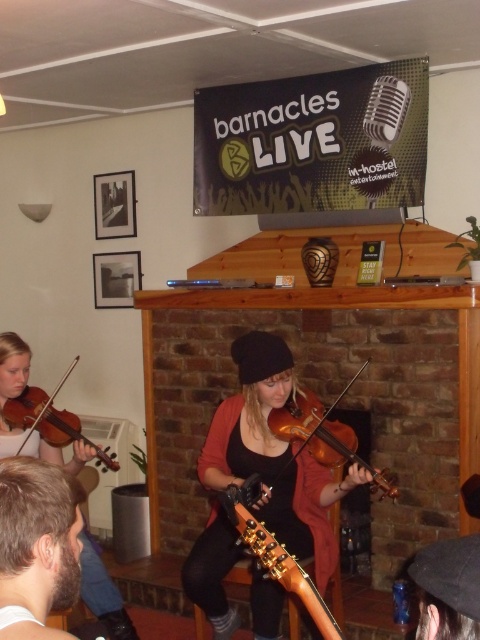
Is matte black violin at center to the left of matte brown violin at left from the viewer's perspective?

Correct, you'll find matte black violin at center to the left of matte brown violin at left.

Between point (98, 604) and point (33, 429), which one is positioned behind?

The point (98, 604) is more distant.

Image resolution: width=480 pixels, height=640 pixels. What are the coordinates of `matte black violin at center` in the screenshot? It's located at (17, 396).

Which is below, matte brown violin at center or wooden violin at center?

matte brown violin at center is below.

What do you see at coordinates (274, 456) in the screenshot? I see `matte brown violin at center` at bounding box center [274, 456].

Which is in front, point (254, 593) or point (384, 483)?

Point (384, 483) is more forward.

Identify the location of matte brown violin at center. The width and height of the screenshot is (480, 640). (274, 456).

Measure the distance between point (x=57, y=570) and camera.

The distance of point (x=57, y=570) from camera is 3.52 feet.

Between point (21, 548) and point (55, 440), which one is positioned behind?

The point (55, 440) is more distant.

Locate an element on the screen. bearded man at lower left is located at coordinates (36, 545).